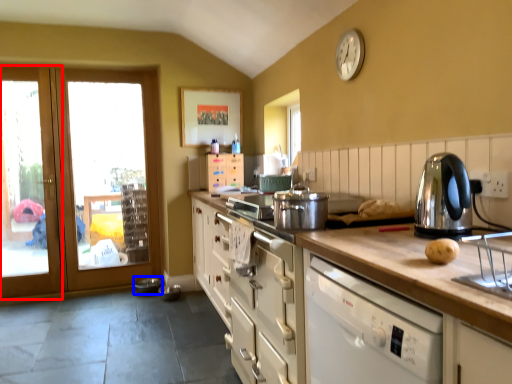
Question: Which point is further to the camera, screen door (highlighted by a red box) or appliance (highlighted by a blue box)?

Choices:
 (A) screen door
 (B) appliance

Answer: (B)